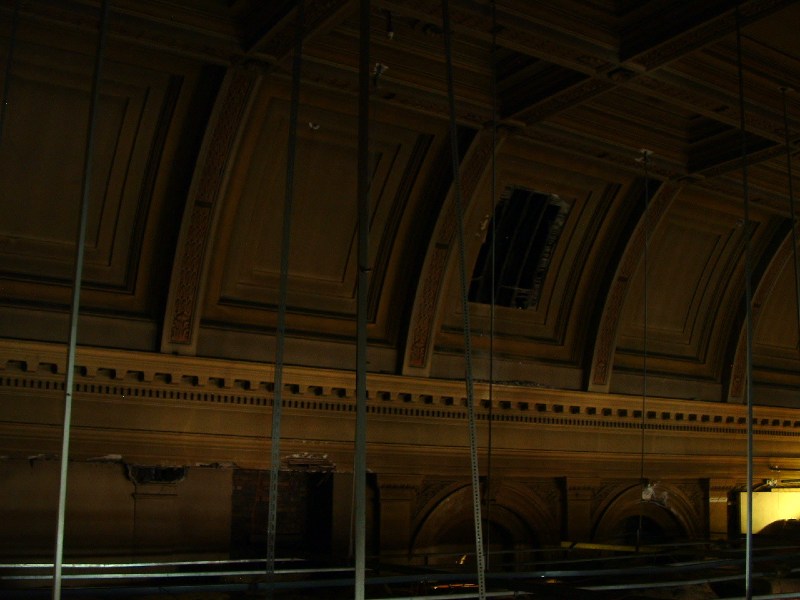
Where is `auditorium area`? auditorium area is located at coordinates (678, 586).